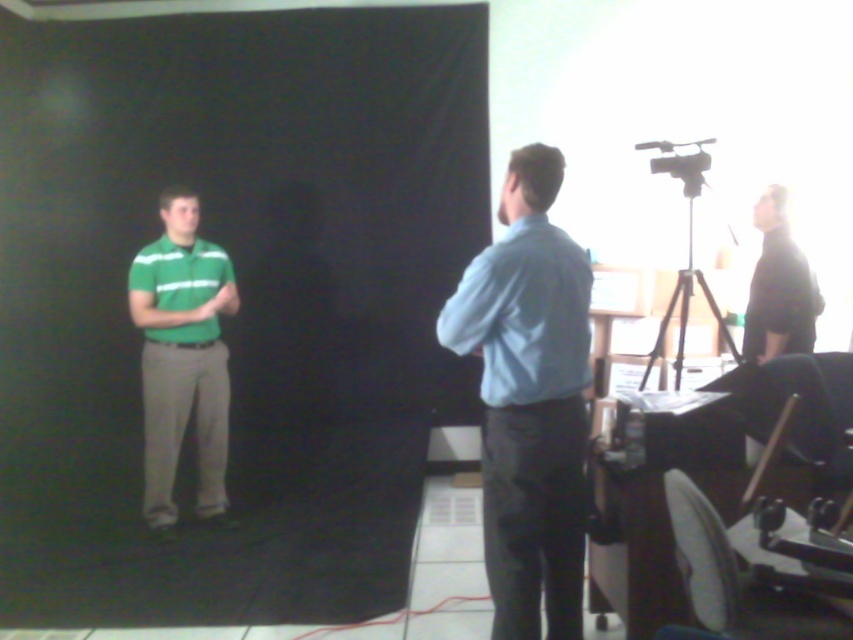
Question: Does green matte shirt at left appear on the right side of black matte shirt at right?

Choices:
 (A) no
 (B) yes

Answer: (A)

Question: Which object appears closest to the camera in this image?

Choices:
 (A) black matte tripod at right
 (B) green matte shirt at left

Answer: (A)

Question: Can you confirm if light blue cotton polo shirt at center is smaller than green matte polo shirt at left?

Choices:
 (A) yes
 (B) no

Answer: (A)

Question: Is light blue shirt at center smaller than green matte polo shirt at left?

Choices:
 (A) no
 (B) yes

Answer: (A)

Question: Which of the following is the farthest from the observer?

Choices:
 (A) green matte polo shirt at left
 (B) light blue cotton polo shirt at center
 (C) black matte tripod at right

Answer: (A)

Question: Which object is the farthest from the light blue cotton polo shirt at center?

Choices:
 (A) black matte tripod at right
 (B) black matte shirt at right
 (C) green matte shirt at left
 (D) light blue shirt at center

Answer: (C)